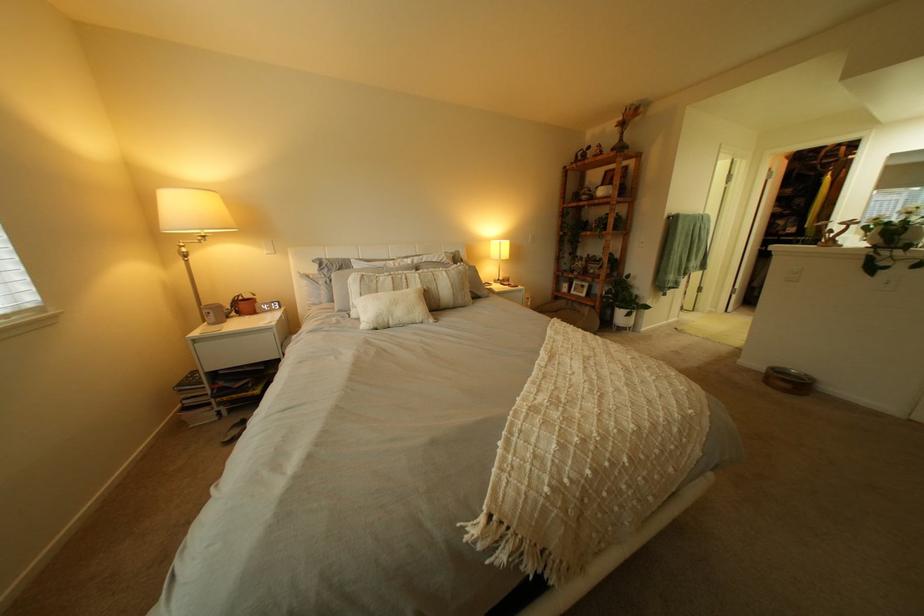
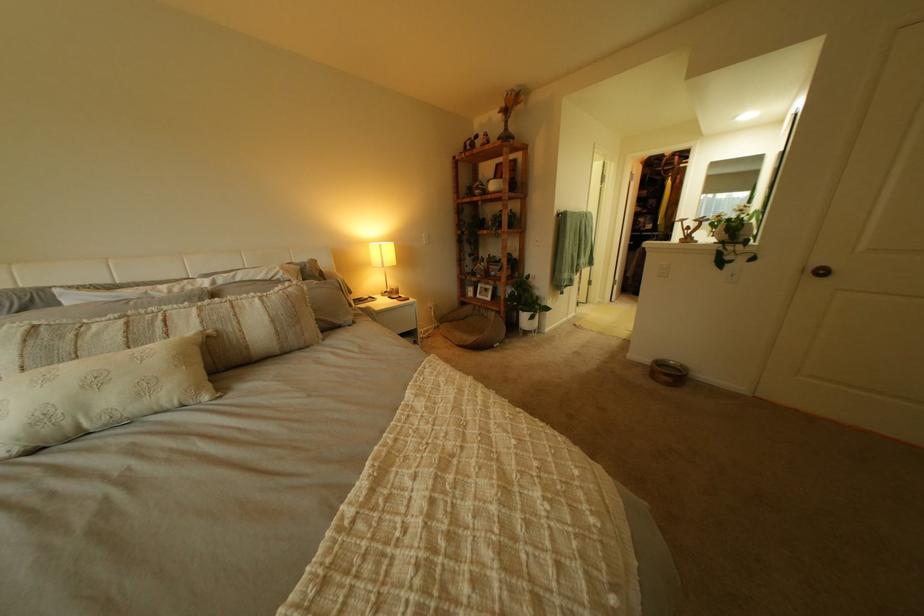
In the second image, find the point that corresponds to (400,320) in the first image.

(80, 424)